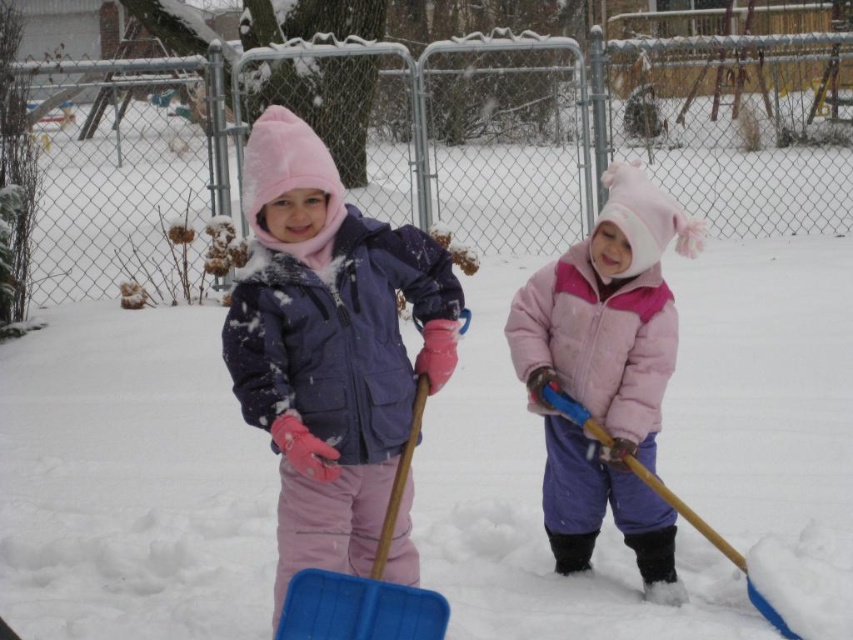
Question: Can you confirm if matte purple jacket at center is positioned below pink fuzzy winter coat at center?

Choices:
 (A) no
 (B) yes

Answer: (A)

Question: Can you confirm if matte purple jacket at center is wider than blue plastic shovel at center?

Choices:
 (A) no
 (B) yes

Answer: (B)

Question: Does pink fuzzy winter coat at center lie in front of blue plastic shovel at lower center?

Choices:
 (A) no
 (B) yes

Answer: (B)

Question: Which point appears closest to the camera in this image?

Choices:
 (A) (576, 419)
 (B) (311, 250)
 (C) (416, 422)

Answer: (B)

Question: Which object is the farthest from the pink fuzzy winter coat at center?

Choices:
 (A) blue plastic shovel at center
 (B) matte purple jacket at center
 (C) blue plastic shovel at lower center

Answer: (A)

Question: Which object appears closest to the camera in this image?

Choices:
 (A) blue plastic shovel at center
 (B) blue plastic shovel at lower center
 (C) matte purple jacket at center
 (D) pink fuzzy winter coat at center

Answer: (A)